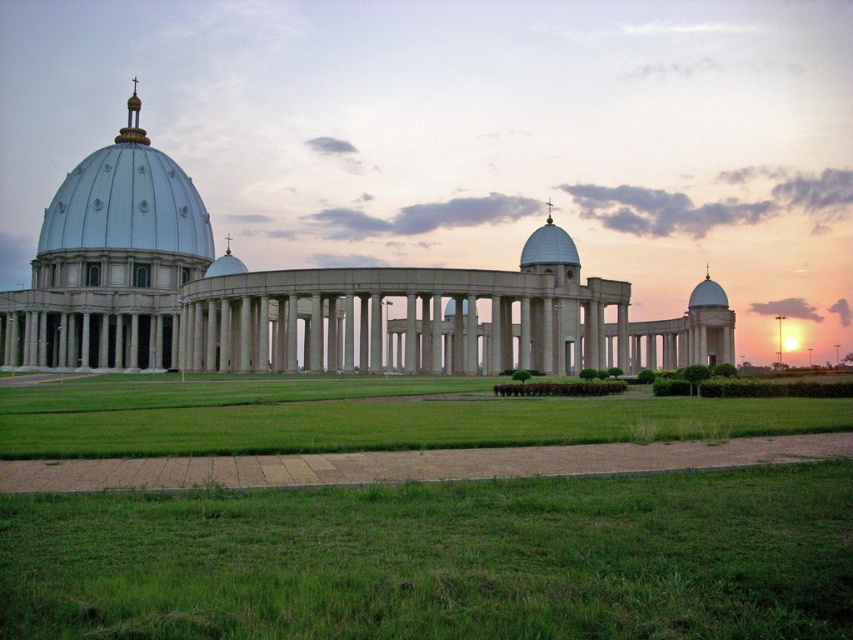
You are a landscape architect designing a garden path. You have to decide where to place a decorative stone. The green grass at lower center and the green grass at center are both in your view. Which area has a wider space for placing the stone?

A: The green grass at center has a greater width compared to the green grass at lower center, so the stone should be placed there for more space.

You are standing in front of the grand building and want to place a small statue exactly halfway between point [483,550] and point [132,104]. Which direction should you move from the closer point to reach the halfway point?

You should move towards the point [132,104] from point [483,550] to reach the halfway point between them.